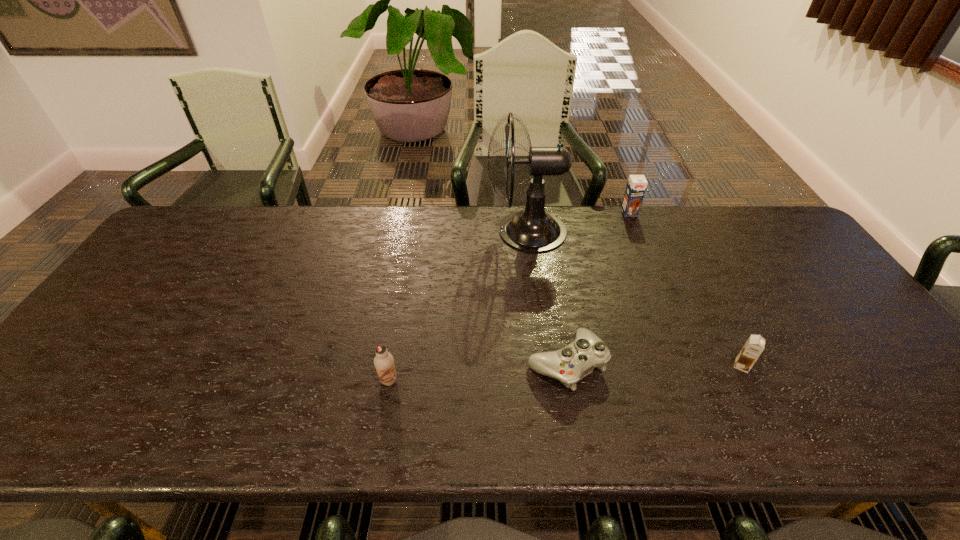
In order to click on vacant position located on the front-facing side of the tallest object in this screenshot , I will do pos(403,231).

Locate an element on the screen. free location located on the front label of the second object from right to left is located at coordinates (636, 232).

This screenshot has width=960, height=540. Find the location of `blank area located on the right of the leftmost chocolate milk`. blank area located on the right of the leftmost chocolate milk is located at coordinates (558, 380).

The height and width of the screenshot is (540, 960). Identify the location of vacant space positioned 0.180m on the left of the shortest chocolate milk. (658, 366).

Locate an element on the screen. free region located on the back of the shortest object is located at coordinates (548, 252).

Find the location of a particular element. The image size is (960, 540). fan that is at the far edge is located at coordinates (533, 230).

Identify the location of chocolate milk at the far edge. This screenshot has height=540, width=960. (636, 186).

In order to click on vacant space at the far edge of the desktop in this screenshot , I will do `click(348, 217)`.

In the image, there is a desktop. Where is `free region at the near edge`? The image size is (960, 540). free region at the near edge is located at coordinates (116, 416).

The image size is (960, 540). In the image, there is a desktop. In order to click on vacant space at the left edge in this screenshot , I will do `click(146, 299)`.